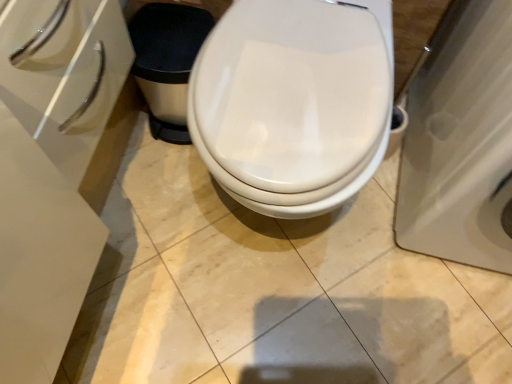
At what (x,y) coordinates should I click in order to perform the action: click on free space above white glossy toilet at center (from a real-world perspective). Please return your answer as a coordinate pair (x, y). This screenshot has width=512, height=384. Looking at the image, I should click on (284, 86).